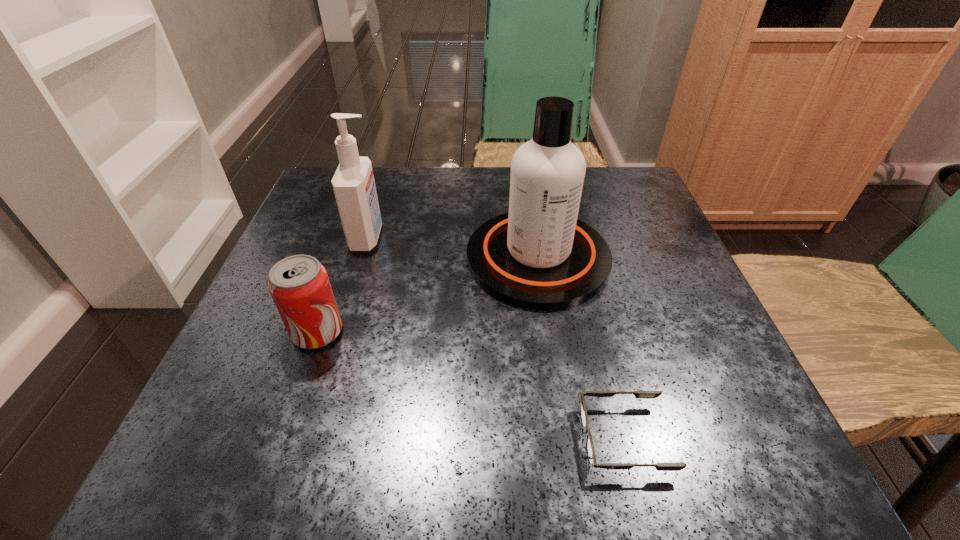
Locate an element on the screen. This screenshot has width=960, height=540. object present at the near right corner is located at coordinates (590, 451).

The image size is (960, 540). Find the location of `blank space at the far edge of the desktop`. blank space at the far edge of the desktop is located at coordinates (398, 173).

In the image, there is a desktop. Identify the location of blank space at the near edge. The image size is (960, 540). (411, 417).

This screenshot has height=540, width=960. In the image, there is a desktop. In order to click on vacant space at the left edge in this screenshot , I will do `click(268, 322)`.

You are a GUI agent. You are given a task and a screenshot of the screen. Output one action in this format:
    pyautogui.click(x=<x>, y=<y>)
    Task: Click on the blank space at the right edge
    
    Given the screenshot: What is the action you would take?
    pyautogui.click(x=660, y=360)

In the image, there is a desktop. Identify the location of vacant area at the far right corner. (586, 200).

At what (x,y) coordinates should I click in order to perform the action: click on blank region between the second tallest object and the right cleansing agent. Please return your answer as a coordinate pair (x, y). This screenshot has height=540, width=960. Looking at the image, I should click on (453, 248).

Identify the location of empty space between the right cleansing agent and the shorter cleansing agent. (453, 248).

Locate an element on the screen. The image size is (960, 540). free space between the left cleansing agent and the soda can is located at coordinates (343, 285).

At what (x,y) coordinates should I click in order to perform the action: click on empty space that is in between the shorter cleansing agent and the shortest object. Please return your answer as a coordinate pair (x, y). Looking at the image, I should click on (495, 338).